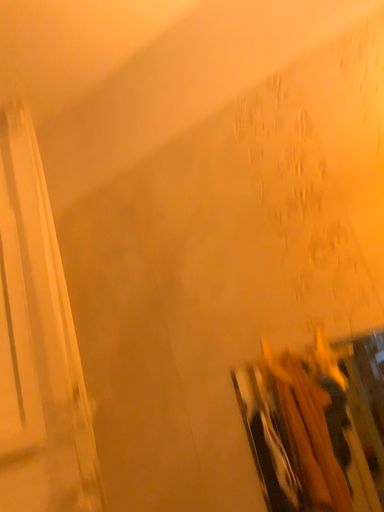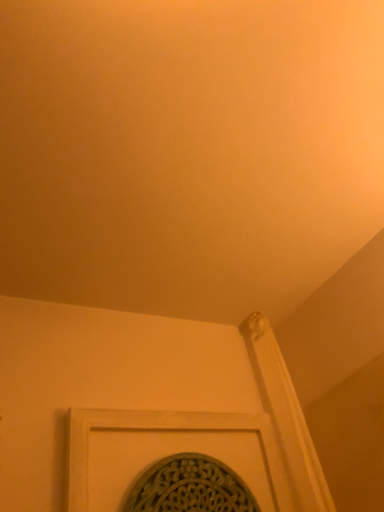
Question: How did the camera likely rotate when shooting the video?

Choices:
 (A) rotated right
 (B) rotated left

Answer: (B)